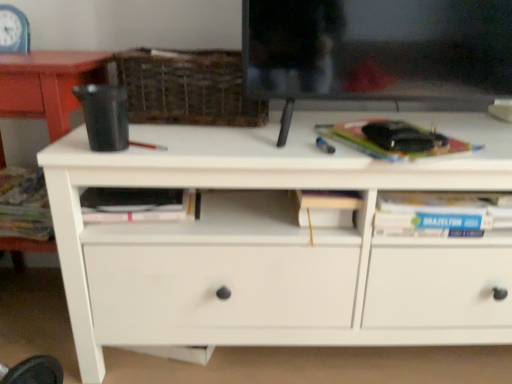
Question: Is pink matte paperback book at center, the 1th paperback book positioned from the bottom, taller than hardcover book at left?

Choices:
 (A) yes
 (B) no

Answer: (B)

Question: Can you confirm if pink matte paperback book at center, the 2th paperback book in the top-to-bottom sequence, is shorter than hardcover book at left?

Choices:
 (A) no
 (B) yes

Answer: (B)

Question: From a real-world perspective, is pink matte paperback book at center, the 2th paperback book in the top-to-bottom sequence, positioned over hardcover book at left based on gravity?

Choices:
 (A) yes
 (B) no

Answer: (A)

Question: From a real-world perspective, is pink matte paperback book at center, arranged as the first paperback book when viewed from the left, beneath hardcover book at left?

Choices:
 (A) yes
 (B) no

Answer: (B)

Question: Considering the relative positions of pink matte paperback book at center, acting as the second paperback book starting from the right, and hardcover book at left in the image provided, is pink matte paperback book at center, acting as the second paperback book starting from the right, to the right of hardcover book at left from the viewer's perspective?

Choices:
 (A) no
 (B) yes

Answer: (B)

Question: Is pink matte paperback book at center, arranged as the first paperback book when viewed from the left, facing towards hardcover book at left?

Choices:
 (A) yes
 (B) no

Answer: (B)

Question: Is pink matte paperback book at center, the 1th paperback book positioned from the bottom, facing towards woven brown basket at upper center?

Choices:
 (A) yes
 (B) no

Answer: (B)

Question: From a real-world perspective, is pink matte paperback book at center, acting as the second paperback book starting from the right, on top of woven brown basket at upper center?

Choices:
 (A) no
 (B) yes

Answer: (A)

Question: Considering the relative positions of pink matte paperback book at center, the 2th paperback book in the top-to-bottom sequence, and woven brown basket at upper center in the image provided, is pink matte paperback book at center, the 2th paperback book in the top-to-bottom sequence, to the left of woven brown basket at upper center from the viewer's perspective?

Choices:
 (A) no
 (B) yes

Answer: (B)

Question: Can you confirm if pink matte paperback book at center, the 1th paperback book positioned from the bottom, is taller than woven brown basket at upper center?

Choices:
 (A) yes
 (B) no

Answer: (B)

Question: From the image's perspective, does pink matte paperback book at center, acting as the second paperback book starting from the right, appear lower than woven brown basket at upper center?

Choices:
 (A) no
 (B) yes

Answer: (B)

Question: Considering the relative sizes of pink matte paperback book at center, acting as the second paperback book starting from the right, and woven brown basket at upper center in the image provided, is pink matte paperback book at center, acting as the second paperback book starting from the right, shorter than woven brown basket at upper center?

Choices:
 (A) no
 (B) yes

Answer: (B)

Question: Is white matte chest of drawers at center located outside blue plastic clock at upper left?

Choices:
 (A) no
 (B) yes

Answer: (B)